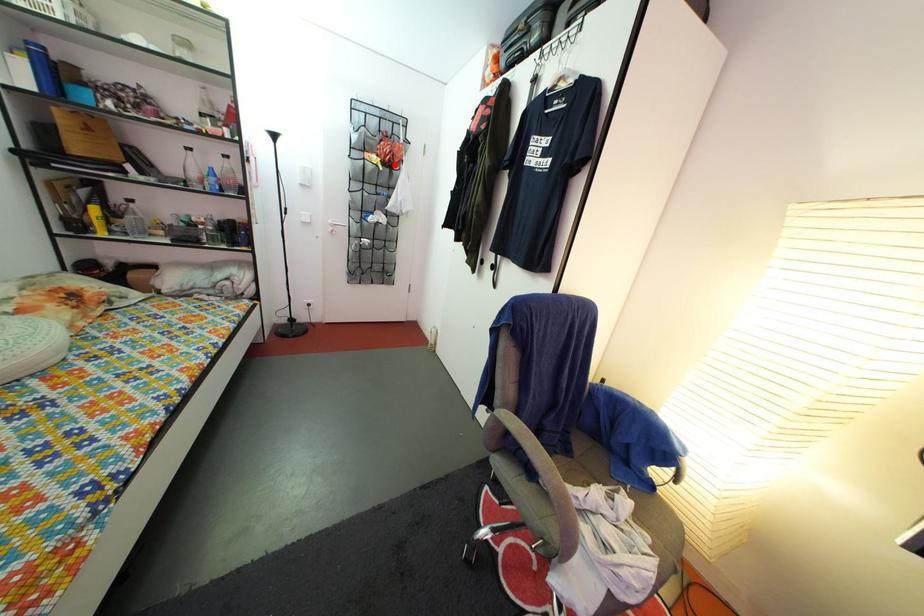
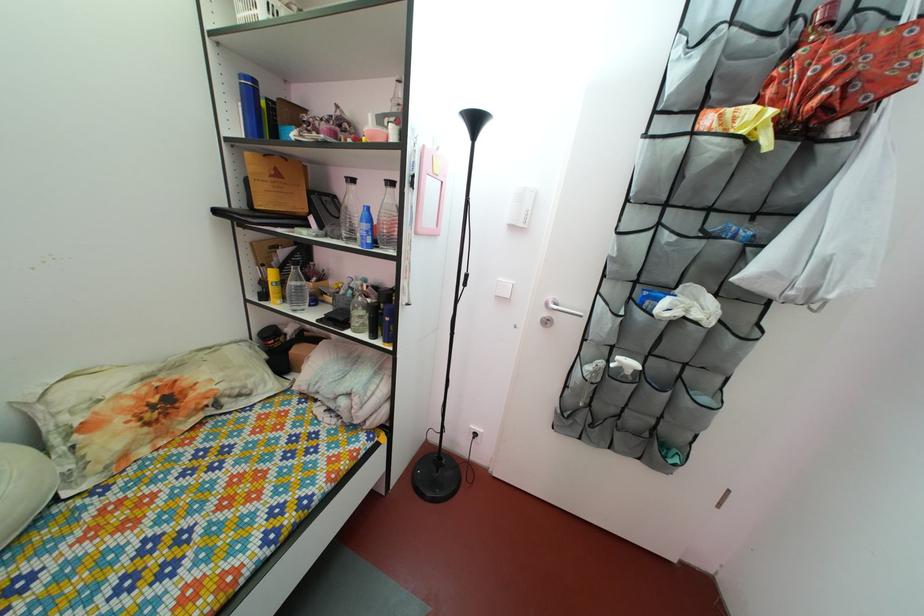
Question: I am providing you with two images of the same scene from different viewpoints. In image1, a red point is highlighted. Considering the same 3D point in image2, which of the following is correct?

Choices:
 (A) It is closer
 (B) It is farther

Answer: (B)